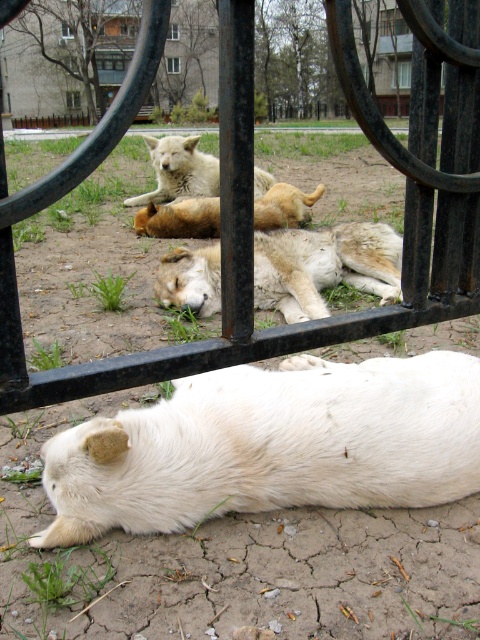
Between white fluffy dog at center and white fur dog at upper center, which one is positioned higher?

white fur dog at upper center is above.

Does white fluffy dog at center have a greater height compared to white fur dog at upper center?

No.

Which is in front, point (60, 483) or point (160, 170)?

Point (60, 483) is more forward.

Identify the location of white fluffy dog at center. (271, 445).

Between point (168, 301) and point (134, 221), which one is positioned in front?

Point (168, 301)

Which is behind, point (377, 266) or point (300, 196)?

Point (300, 196)

Which is in front, point (331, 262) or point (264, 204)?

Point (331, 262)

The width and height of the screenshot is (480, 640). Find the location of `white fur dog at center`. white fur dog at center is located at coordinates (324, 266).

Is point (463, 227) positioned in front of point (280, 216)?

Yes, point (463, 227) is closer to viewer.

Does black metal gate at center lie behind golden fur dog at center?

No.

Who is more forward, (146, 68) or (310, 195)?

Point (146, 68)

Where is `black metal gate at center`? The height and width of the screenshot is (640, 480). black metal gate at center is located at coordinates (250, 202).